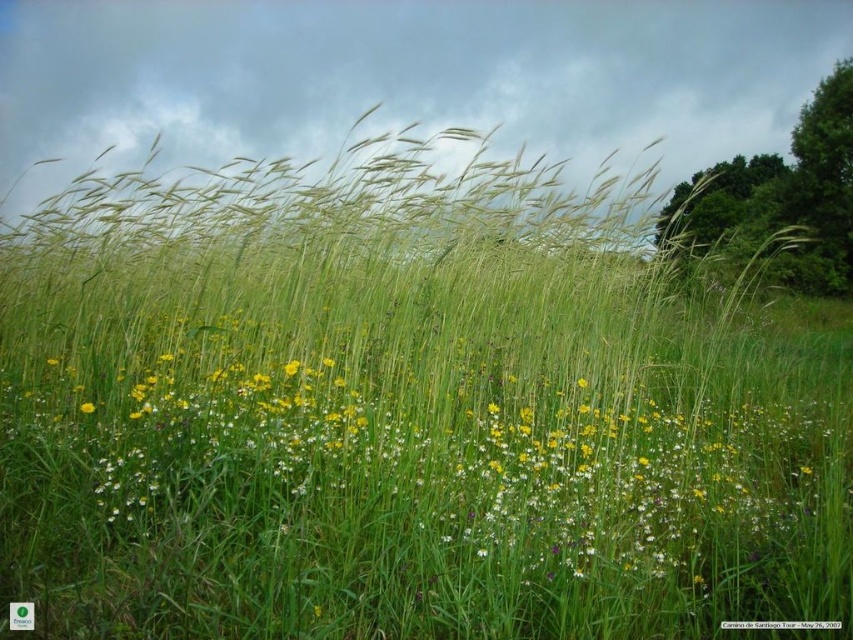
Is point (93, 403) more distant than point (50, 362)?

No, (93, 403) is in front of (50, 362).

Does yellow matte flower at lower left have a smaller size compared to white matte flower at center?

No.

Who is more forward, (x=82, y=412) or (x=48, y=356)?

Point (x=82, y=412) is in front.

Where is `yellow matte flower at lower left`? Image resolution: width=853 pixels, height=640 pixels. yellow matte flower at lower left is located at coordinates (86, 406).

Who is higher up, green grass at center or yellow matte flower at lower left?

yellow matte flower at lower left is above.

Between green grass at center and yellow matte flower at lower left, which one appears on the left side from the viewer's perspective?

yellow matte flower at lower left is more to the left.

Locate an element on the screen. This screenshot has height=640, width=853. green grass at center is located at coordinates (425, 472).

The image size is (853, 640). What are the coordinates of `green grass at center` in the screenshot? It's located at (425, 472).

Does green grass at center appear on the right side of white matte flower at center?

Indeed, green grass at center is positioned on the right side of white matte flower at center.

Who is more distant from viewer, (x=368, y=372) or (x=54, y=364)?

Positioned behind is point (x=54, y=364).

Locate an element on the screen. green grass at center is located at coordinates (425, 472).